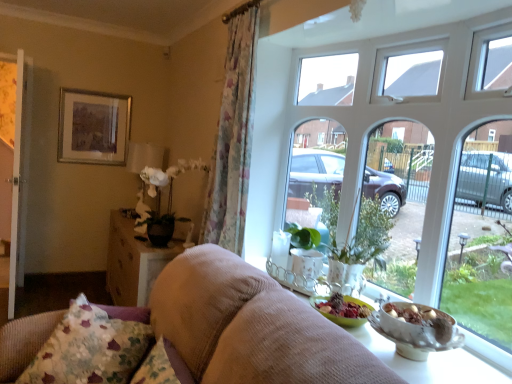
Question: Should I look upward or downward to see suede-like beige sofa at center?

Choices:
 (A) down
 (B) up

Answer: (A)

Question: Would you say wooden textured table at lower left contains white matte floral arrangement at center-left?

Choices:
 (A) yes
 (B) no

Answer: (B)

Question: Can you confirm if wooden textured table at lower left is smaller than white matte floral arrangement at center-left?

Choices:
 (A) no
 (B) yes

Answer: (A)

Question: Is wooden textured table at lower left touching white matte floral arrangement at center-left?

Choices:
 (A) no
 (B) yes

Answer: (A)

Question: Does wooden textured table at lower left have a greater height compared to white matte floral arrangement at center-left?

Choices:
 (A) no
 (B) yes

Answer: (B)

Question: From a real-world perspective, is wooden textured table at lower left located beneath white matte floral arrangement at center-left?

Choices:
 (A) yes
 (B) no

Answer: (A)

Question: Is wooden textured table at lower left not inside white matte floral arrangement at center-left?

Choices:
 (A) no
 (B) yes

Answer: (B)

Question: Does suede-like beige sofa at center have a larger size compared to white glass window at upper center?

Choices:
 (A) no
 (B) yes

Answer: (B)

Question: Is suede-like beige sofa at center oriented towards white glass window at upper center?

Choices:
 (A) no
 (B) yes

Answer: (A)

Question: Is suede-like beige sofa at center next to white glass window at upper center and touching it?

Choices:
 (A) no
 (B) yes

Answer: (A)

Question: Considering the relative sizes of suede-like beige sofa at center and white glass window at upper center in the image provided, is suede-like beige sofa at center wider than white glass window at upper center?

Choices:
 (A) no
 (B) yes

Answer: (B)

Question: From a real-world perspective, is suede-like beige sofa at center located higher than white glass window at upper center?

Choices:
 (A) yes
 (B) no

Answer: (B)

Question: Can you confirm if suede-like beige sofa at center is positioned to the left of white glass window at upper center?

Choices:
 (A) no
 (B) yes

Answer: (B)

Question: Is floral fabric curtain at left at the left side of white matte floral arrangement at center-left?

Choices:
 (A) yes
 (B) no

Answer: (B)